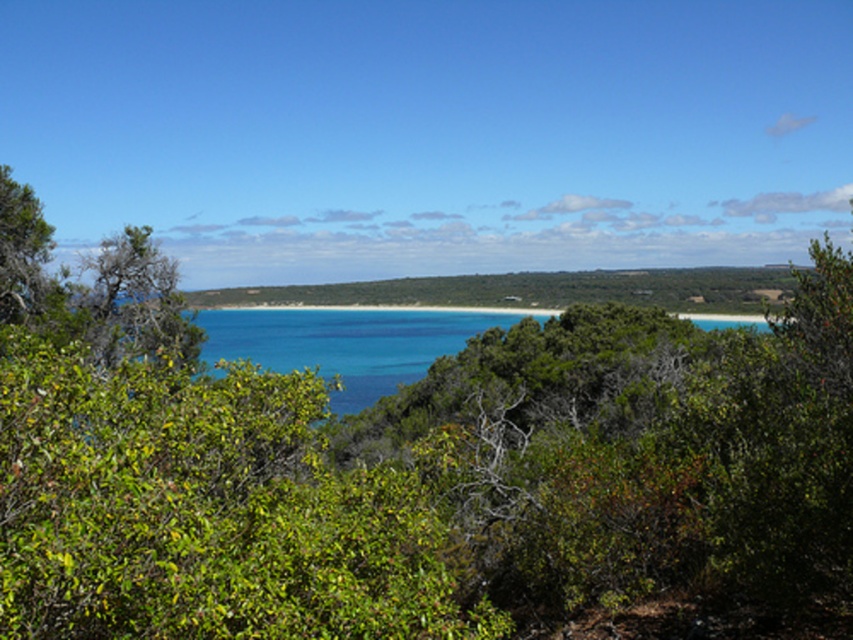
Question: Among these points, which one is nearest to the camera?

Choices:
 (A) (473, 314)
 (B) (732, 436)

Answer: (B)

Question: Can you confirm if green leafy bush at center is smaller than blue water at center?

Choices:
 (A) yes
 (B) no

Answer: (A)

Question: Is green leafy bush at center further to the viewer compared to blue water at center?

Choices:
 (A) yes
 (B) no

Answer: (B)

Question: Is green leafy bush at center smaller than blue water at center?

Choices:
 (A) yes
 (B) no

Answer: (A)